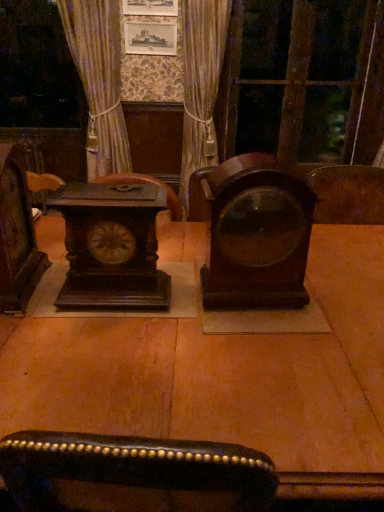
Where is `vacant point above mahogany wood alarm clock at center, which is counted as the 1th alarm clock, starting from the right (from a real-world perspective)`? Image resolution: width=384 pixels, height=512 pixels. vacant point above mahogany wood alarm clock at center, which is counted as the 1th alarm clock, starting from the right (from a real-world perspective) is located at coordinates (258, 158).